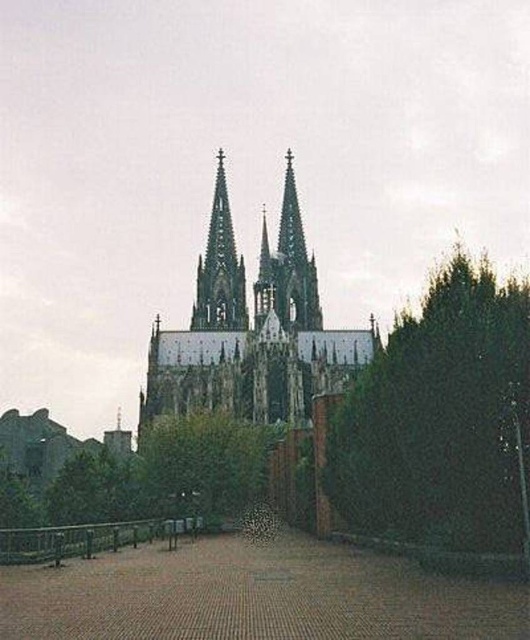
Looking at this image, is green leafy tree at center smaller than smooth stone spire at center?

→ Yes.

Is green leafy tree at center positioned behind smooth stone spire at center?

No.

Locate an element on the screen. green leafy tree at center is located at coordinates (201, 465).

From the picture: Does green leafy tree at right have a greater width compared to smooth gray spire at center?

Correct, the width of green leafy tree at right exceeds that of smooth gray spire at center.

Is green leafy tree at right to the left of smooth gray spire at center from the viewer's perspective?

No, green leafy tree at right is not to the left of smooth gray spire at center.

At what (x,y) coordinates should I click in order to perform the action: click on green leafy tree at right. Please return your answer as a coordinate pair (x, y). This screenshot has height=640, width=530. Looking at the image, I should click on (440, 419).

Find the location of a particular element. This screenshot has width=530, height=640. green leafy tree at right is located at coordinates (440, 419).

Can you confirm if green leafy tree at right is positioned above stone gothic cathedral at center?

Incorrect, green leafy tree at right is not positioned above stone gothic cathedral at center.

Is point (498, 472) in front of point (220, 401)?

Yes, it is.

Identify the location of green leafy tree at right. (440, 419).